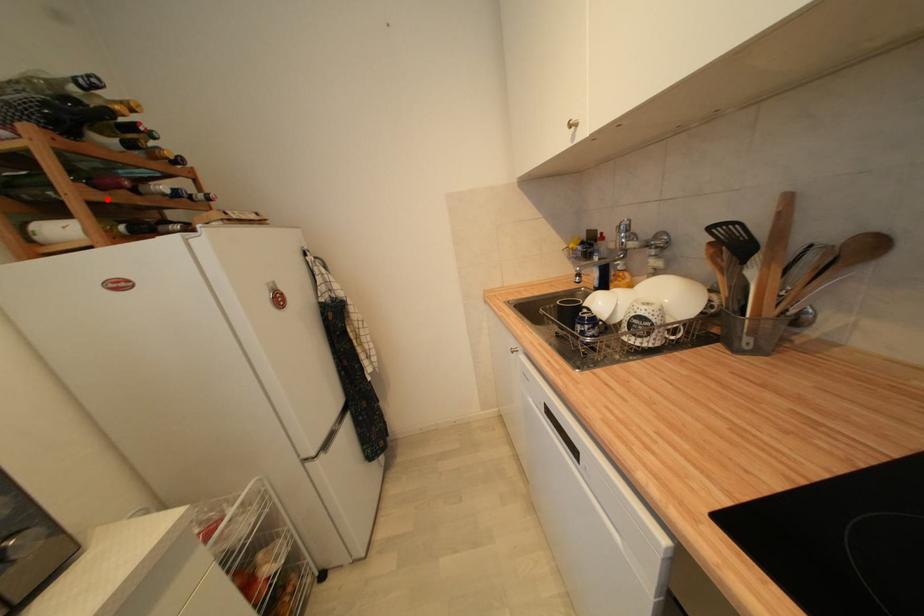
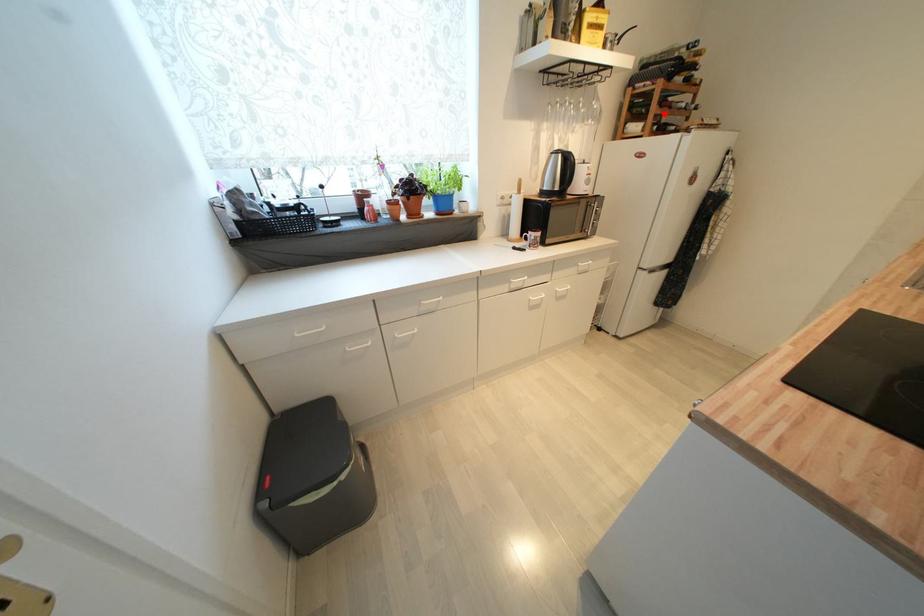
I am providing you with two images of the same scene from different viewpoints. A red point is marked on the first image and another point is marked on the second image. Do the highlighted points in image1 and image2 indicate the same real-world spot?

Yes